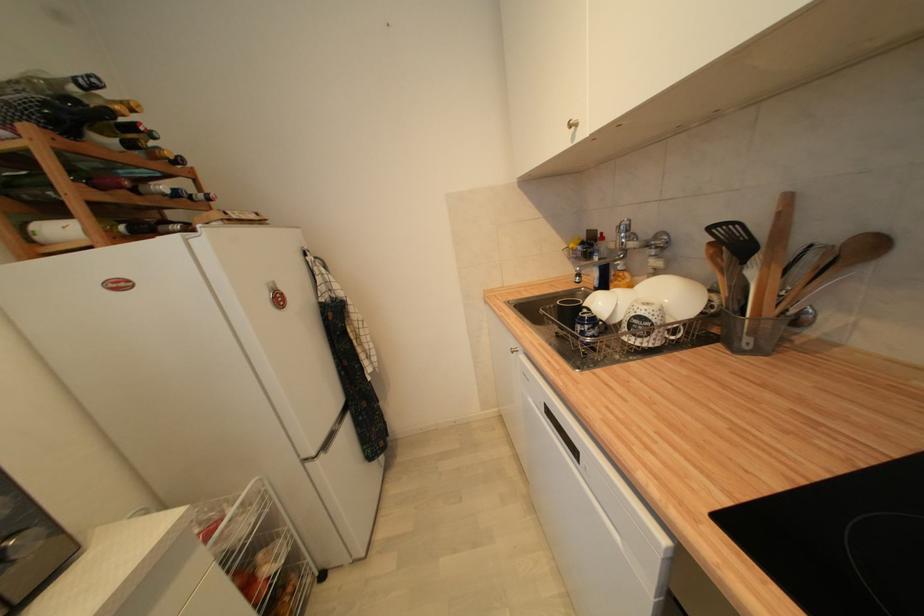
Where would you lift the mug handle? Please return your answer as a coordinate pair (x, y).

(588, 334)